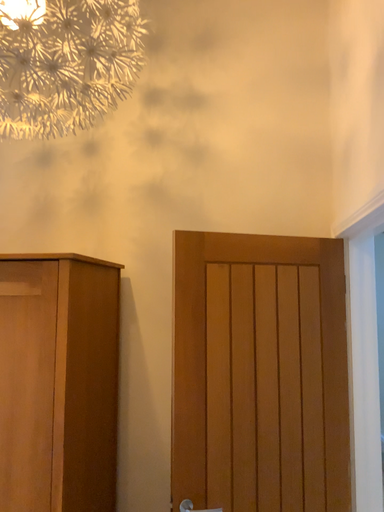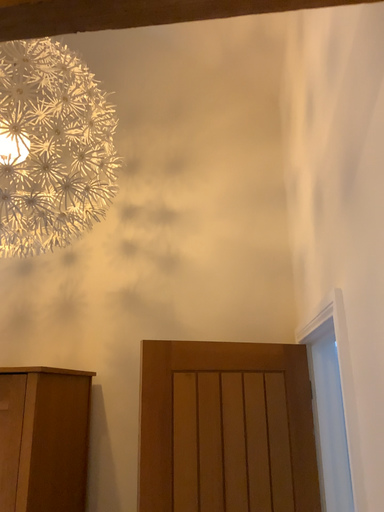
Question: How did the camera likely rotate when shooting the video?

Choices:
 (A) rotated upward
 (B) rotated downward

Answer: (A)